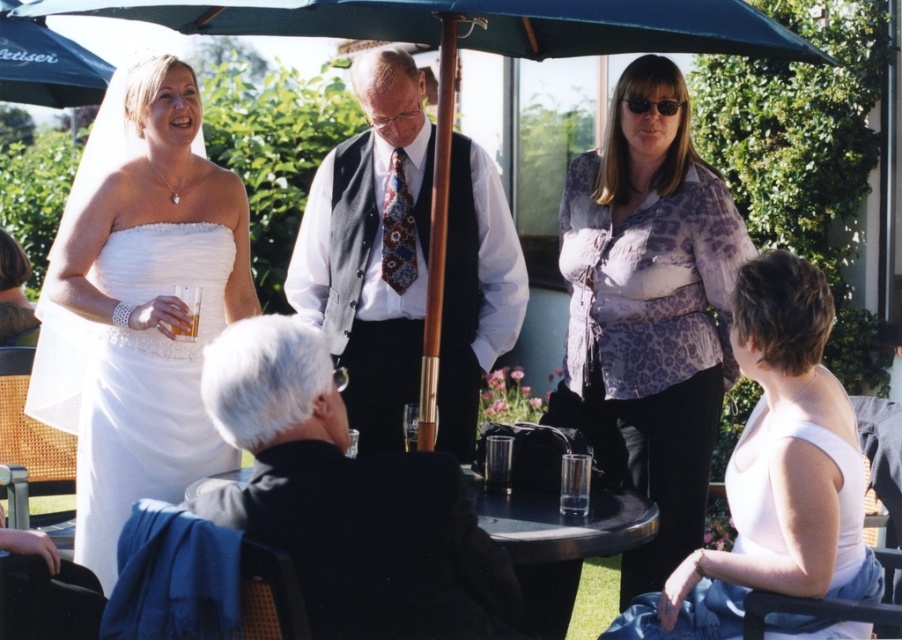
Is black wool jacket at lower left to the left of white shirt with vest at center from the viewer's perspective?

No, black wool jacket at lower left is not to the left of white shirt with vest at center.

Who is lower down, black wool jacket at lower left or white shirt with vest at center?

black wool jacket at lower left

Describe the element at coordinates (347, 500) in the screenshot. The image size is (902, 640). I see `black wool jacket at lower left` at that location.

This screenshot has width=902, height=640. I want to click on black wool jacket at lower left, so click(347, 500).

Can you confirm if white satin dress at upper left is shorter than white shirt with vest at center?

Incorrect, white satin dress at upper left's height does not fall short of white shirt with vest at center's.

Is white satin dress at upper left bigger than white shirt with vest at center?

Correct, white satin dress at upper left is larger in size than white shirt with vest at center.

Locate an element on the screen. The width and height of the screenshot is (902, 640). white satin dress at upper left is located at coordinates (139, 305).

Is white satin dress at upper left in front of printed silk blouse at upper center?

Yes, white satin dress at upper left is closer to the viewer.

Can you confirm if white satin dress at upper left is taller than printed silk blouse at upper center?

No, white satin dress at upper left is not taller than printed silk blouse at upper center.

The height and width of the screenshot is (640, 902). In order to click on white satin dress at upper left in this screenshot , I will do `click(139, 305)`.